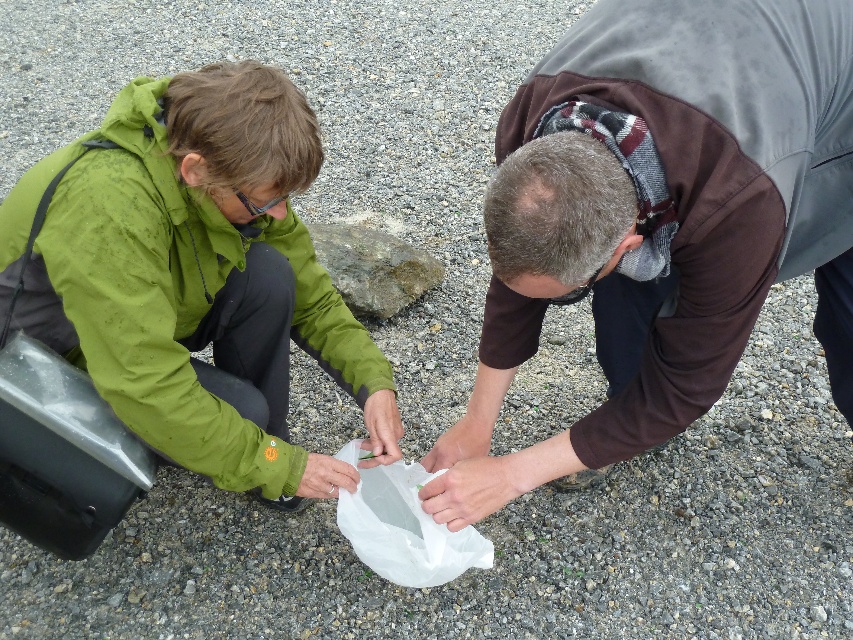
Question: Among these points, which one is nearest to the camera?

Choices:
 (A) click(x=119, y=356)
 (B) click(x=349, y=445)
 (C) click(x=686, y=273)

Answer: (C)

Question: Which object is farther from the camera taking this photo?

Choices:
 (A) green matte jacket at left
 (B) transparent plastic bag at center

Answer: (B)

Question: Can you confirm if brown fleece jacket at center is positioned to the left of green matte jacket at left?

Choices:
 (A) yes
 (B) no

Answer: (B)

Question: Can you confirm if green matte jacket at left is positioned to the left of transparent plastic bag at center?

Choices:
 (A) no
 (B) yes

Answer: (B)

Question: Which point is farther from the camera taking this photo?

Choices:
 (A) (387, 516)
 (B) (740, 220)

Answer: (A)

Question: Is brown fleece jacket at center behind transparent plastic bag at center?

Choices:
 (A) yes
 (B) no

Answer: (B)